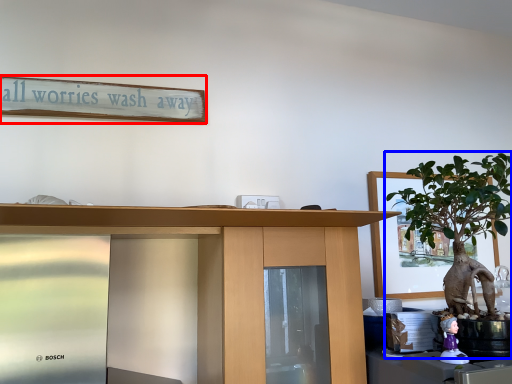
Question: Among these objects, which one is nearest to the camera, bulletin board (highlighted by a red box) or houseplant (highlighted by a blue box)?

Choices:
 (A) bulletin board
 (B) houseplant

Answer: (B)